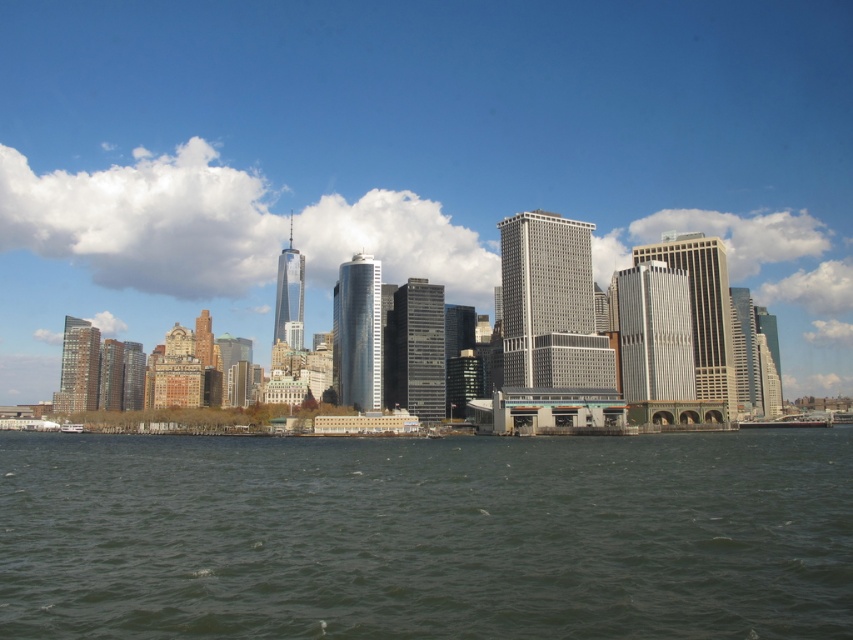
You are a photographer planning to capture the city skyline from the water. You have a white plastic boat at lower left and greenish water at lower center. Which object would occupy more space in your photo if you focus on the lower part of the image?

The greenish water at lower center occupies more space in the photo than the white plastic boat at lower left because it is bigger according to the description.

You are standing on the shore looking at the city skyline. There are two points marked in the image. The first point is located at coordinates point [280,58], and the second point is at point [64,424]. If you were to walk towards the water, which of these points would appear closer to you in the image?

Point [280,58] is further to the camera than point [64,424], so when you walk towards the water, the point that appears closer to you would be point [64,424] because it is physically closer to your position.